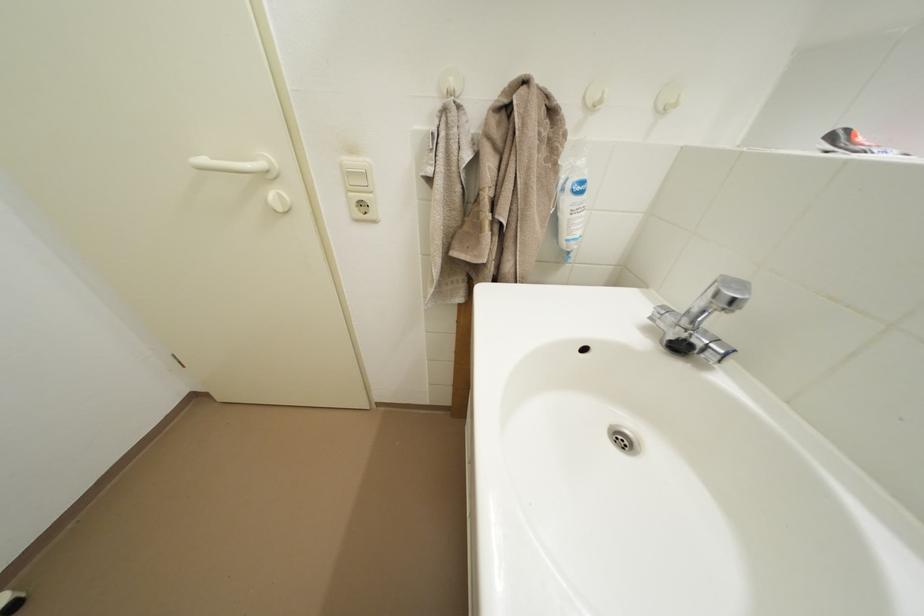
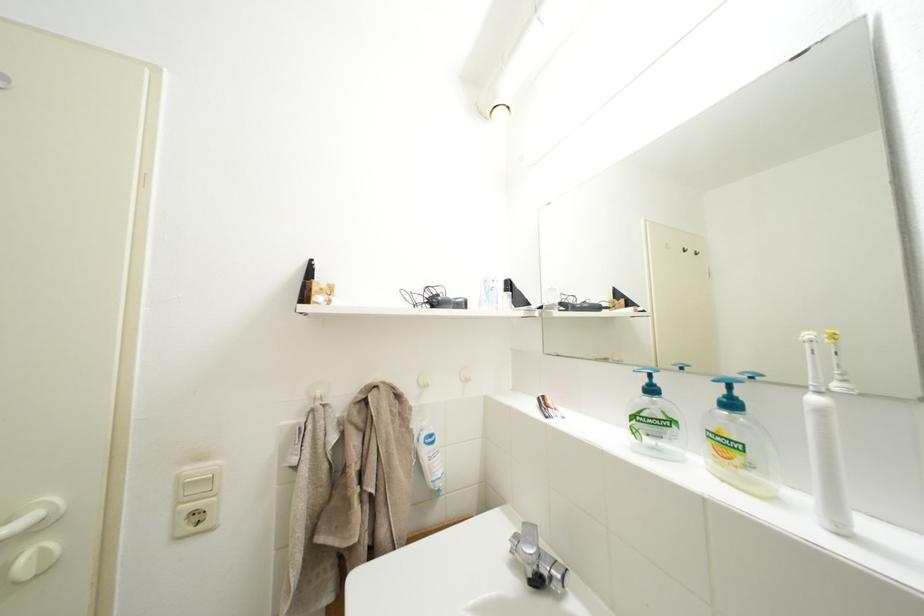
Locate, in the second image, the point that corresponds to (x=358, y=205) in the first image.

(185, 519)